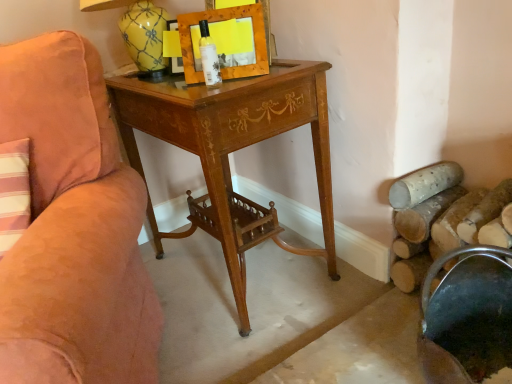
This screenshot has width=512, height=384. Find the location of `free space in front of clear glass bottle at center`. free space in front of clear glass bottle at center is located at coordinates (210, 94).